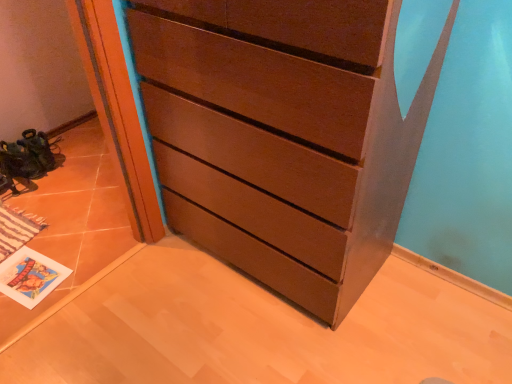
What do you see at coordinates (283, 136) in the screenshot? I see `matte brown chest of drawers at center` at bounding box center [283, 136].

The image size is (512, 384). In order to click on matte brown chest of drawers at center in this screenshot , I will do 283,136.

The height and width of the screenshot is (384, 512). I want to click on matte brown chest of drawers at center, so click(x=283, y=136).